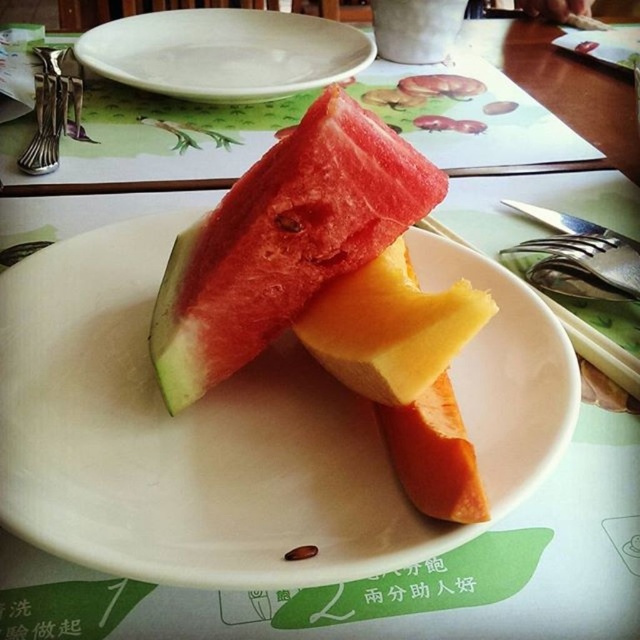
Does point (186, 492) come closer to viewer compared to point (44, 115)?

Yes.

Is white glossy plate at center to the left of satin nickel forks at left from the viewer's perspective?

No, white glossy plate at center is not to the left of satin nickel forks at left.

You are a GUI agent. You are given a task and a screenshot of the screen. Output one action in this format:
    pyautogui.click(x=<x>, y=<y>)
    Task: Click on the white glossy plate at center
    This screenshot has width=640, height=640.
    Given the screenshot: What is the action you would take?
    pyautogui.click(x=243, y=426)

Locate an element on the screen. This screenshot has height=640, width=640. white glossy plate at center is located at coordinates (243, 426).

Who is higher up, red matte watermelon at center or yellow smooth melon at center?

Positioned higher is red matte watermelon at center.

Who is lower down, red matte watermelon at center or yellow smooth melon at center?

yellow smooth melon at center is lower down.

Does point (440, 198) come behind point (381, 317)?

Yes, it is.

This screenshot has width=640, height=640. I want to click on red matte watermelon at center, so pos(284,241).

Where is `yellow smooth melon at center`? Image resolution: width=640 pixels, height=640 pixels. yellow smooth melon at center is located at coordinates (390, 326).

Which is in front, point (426, 349) or point (385, 428)?

Positioned in front is point (426, 349).

The image size is (640, 640). What do you see at coordinates (390, 326) in the screenshot? I see `yellow smooth melon at center` at bounding box center [390, 326].

Identify the location of yellow smooth melon at center. (390, 326).